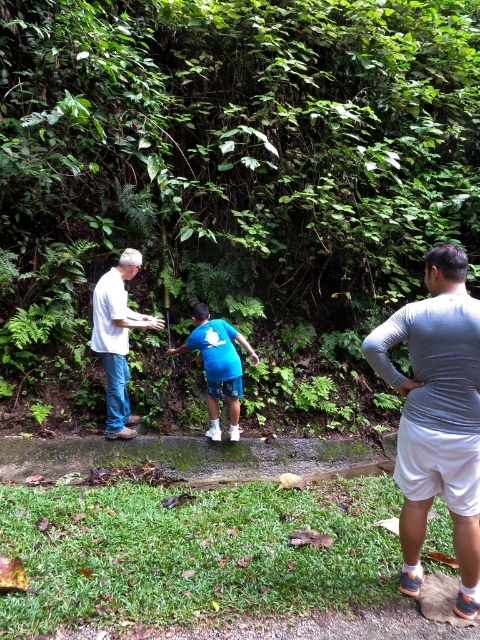
Question: Among these points, which one is nearest to the camera?

Choices:
 (A) (220, 348)
 (B) (445, 456)
 (C) (108, 400)

Answer: (B)

Question: Does gray long-sleeved shirt at right have a greater width compared to white matte shirt at left?

Choices:
 (A) yes
 (B) no

Answer: (B)

Question: Among these points, which one is nearest to the camera?

Choices:
 (A) (243, 340)
 (B) (471, 410)
 (C) (115, 390)

Answer: (B)

Question: Estimate the real-world distances between objects in this image. Which object is farther from the blue cotton shirt at center?

Choices:
 (A) gray long-sleeved shirt at right
 (B) white matte shirt at left

Answer: (A)

Question: Is gray long-sleeved shirt at right wider than white matte shirt at left?

Choices:
 (A) no
 (B) yes

Answer: (A)

Question: Is the position of white matte shirt at left less distant than that of blue cotton shirt at center?

Choices:
 (A) no
 (B) yes

Answer: (B)